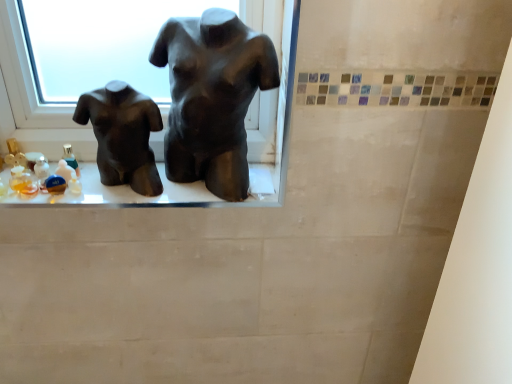
In order to face matte black torso at left, which ranks as the 2th statue (sculpture) in right-to-left order, should I rotate leftwards or rightwards?

A 17.664 degree turn to the left will do.

The height and width of the screenshot is (384, 512). What do you see at coordinates (212, 97) in the screenshot? I see `matte black torso at center, which is the 1th statue (sculpture) in right-to-left order` at bounding box center [212, 97].

Find the location of a particular element. The width and height of the screenshot is (512, 384). matte black torso at left, which appears as the first statue (sculpture) when viewed from the left is located at coordinates (123, 135).

Between matte black torso at left, which ranks as the 2th statue (sculpture) in right-to-left order, and matte black torso at center, which is the 1th statue (sculpture) in right-to-left order, which one is positioned in front?

matte black torso at center, which is the 1th statue (sculpture) in right-to-left order, is more forward.

Does point (155, 119) come farther from viewer compared to point (223, 62)?

Yes, it is behind point (223, 62).

Visually, is matte black torso at left, which ranks as the 2th statue (sculpture) in right-to-left order, positioned to the left or to the right of matte black torso at center, the 2th statue (sculpture) from the left?

matte black torso at left, which ranks as the 2th statue (sculpture) in right-to-left order, is positioned on matte black torso at center, the 2th statue (sculpture) from the left,'s left side.

Consider the image. From the image's perspective, is matte black torso at left, which appears as the first statue (sculpture) when viewed from the left, under matte black torso at center, which is the 1th statue (sculpture) in right-to-left order?

Yes.

Considering the positions of objects matte black torso at left, which ranks as the 2th statue (sculpture) in right-to-left order, and matte black mannequin torso at center in the image provided, who is behind, matte black torso at left, which ranks as the 2th statue (sculpture) in right-to-left order, or matte black mannequin torso at center?

Positioned behind is matte black mannequin torso at center.

Can you tell me how much matte black torso at left, which appears as the first statue (sculpture) when viewed from the left, and matte black mannequin torso at center differ in facing direction?

2.16 degrees separate the facing orientations of matte black torso at left, which appears as the first statue (sculpture) when viewed from the left, and matte black mannequin torso at center.

How much distance is there between matte black torso at left, which ranks as the 2th statue (sculpture) in right-to-left order, and matte black mannequin torso at center?

3.39 inches.

Are matte black torso at left, which appears as the first statue (sculpture) when viewed from the left, and matte black mannequin torso at center located far from each other?

That's not correct — matte black torso at left, which appears as the first statue (sculpture) when viewed from the left, is a little close to matte black mannequin torso at center.

Is matte black torso at center, which is the 1th statue (sculpture) in right-to-left order, wider than matte black mannequin torso at center?

No, matte black torso at center, which is the 1th statue (sculpture) in right-to-left order, is not wider than matte black mannequin torso at center.

From a real-world perspective, is matte black torso at center, the 2th statue (sculpture) from the left, located higher than matte black mannequin torso at center?

Yes, from a real-world perspective, matte black torso at center, the 2th statue (sculpture) from the left, is over matte black mannequin torso at center

Is matte black torso at center, which is the 1th statue (sculpture) in right-to-left order, bigger than matte black mannequin torso at center?

Indeed, matte black torso at center, which is the 1th statue (sculpture) in right-to-left order, has a larger size compared to matte black mannequin torso at center.

Can you tell me how much matte black torso at center, which is the 1th statue (sculpture) in right-to-left order, and matte black mannequin torso at center differ in facing direction?

The facing directions of matte black torso at center, which is the 1th statue (sculpture) in right-to-left order, and matte black mannequin torso at center are 29.9 degrees apart.

Can matte black torso at left, which appears as the first statue (sculpture) when viewed from the left, be found inside matte black torso at center, which is the 1th statue (sculpture) in right-to-left order?

No, matte black torso at left, which appears as the first statue (sculpture) when viewed from the left, is not a part of matte black torso at center, which is the 1th statue (sculpture) in right-to-left order.

Considering the positions of points (244, 55) and (126, 108), is point (244, 55) farther from camera compared to point (126, 108)?

No, (244, 55) is closer to viewer.

From the picture: Is matte black torso at center, the 2th statue (sculpture) from the left, further to camera compared to matte black torso at left, which appears as the first statue (sculpture) when viewed from the left?

No, matte black torso at center, the 2th statue (sculpture) from the left, is in front of matte black torso at left, which appears as the first statue (sculpture) when viewed from the left.

The width and height of the screenshot is (512, 384). In the image, there is a matte black torso at center, the 2th statue (sculpture) from the left. In order to click on statue (sculpture) below it (from the image's perspective) in this screenshot , I will do `click(123, 135)`.

Can you confirm if matte black mannequin torso at center is bigger than matte black torso at left, which ranks as the 2th statue (sculpture) in right-to-left order?

Incorrect, matte black mannequin torso at center is not larger than matte black torso at left, which ranks as the 2th statue (sculpture) in right-to-left order.

Considering their positions, is matte black mannequin torso at center located in front of or behind matte black torso at left, which appears as the first statue (sculpture) when viewed from the left?

Clearly, matte black mannequin torso at center is behind matte black torso at left, which appears as the first statue (sculpture) when viewed from the left.

From a real-world perspective, is matte black mannequin torso at center positioned above or below matte black torso at left, which ranks as the 2th statue (sculpture) in right-to-left order?

In terms of real-world spatial position, matte black mannequin torso at center is below matte black torso at left, which ranks as the 2th statue (sculpture) in right-to-left order.

From the image's perspective, is matte black mannequin torso at center over matte black torso at left, which appears as the first statue (sculpture) when viewed from the left?

Actually, matte black mannequin torso at center appears below matte black torso at left, which appears as the first statue (sculpture) when viewed from the left, in the image.

Considering the relative sizes of matte black mannequin torso at center and matte black torso at center, which is the 1th statue (sculpture) in right-to-left order, in the image provided, is matte black mannequin torso at center bigger than matte black torso at center, which is the 1th statue (sculpture) in right-to-left order,?

No, matte black mannequin torso at center is not bigger than matte black torso at center, which is the 1th statue (sculpture) in right-to-left order.

Considering the sizes of objects matte black mannequin torso at center and matte black torso at center, which is the 1th statue (sculpture) in right-to-left order, in the image provided, who is shorter, matte black mannequin torso at center or matte black torso at center, which is the 1th statue (sculpture) in right-to-left order,?

Standing shorter between the two is matte black mannequin torso at center.

Is the depth of matte black mannequin torso at center greater than that of matte black torso at center, the 2th statue (sculpture) from the left?

Yes, matte black mannequin torso at center is further from the viewer.

Are matte black mannequin torso at center and matte black torso at center, which is the 1th statue (sculpture) in right-to-left order, far apart?

No, matte black mannequin torso at center is not far away from matte black torso at center, which is the 1th statue (sculpture) in right-to-left order.

Locate an element on the screen. Image resolution: width=512 pixels, height=384 pixels. statue (sculpture) below the matte black torso at center, the 2th statue (sculpture) from the left (from a real-world perspective) is located at coordinates [123, 135].

You are a GUI agent. You are given a task and a screenshot of the screen. Output one action in this format:
    pyautogui.click(x=<x>, y=<y>)
    Task: Click on the window sill located on the right of matte black torso at left, which ranks as the 2th statue (sculpture) in right-to-left order
    Image resolution: width=512 pixels, height=384 pixels.
    Given the screenshot: What is the action you would take?
    pyautogui.click(x=119, y=193)

Consider the image. Which object lies further to the anchor point matte black torso at center, which is the 1th statue (sculpture) in right-to-left order, matte black torso at left, which appears as the first statue (sculpture) when viewed from the left, or matte black mannequin torso at center?

matte black mannequin torso at center.

Looking at the image, which one is located further to matte black mannequin torso at center, matte black torso at left, which ranks as the 2th statue (sculpture) in right-to-left order, or matte black torso at center, the 2th statue (sculpture) from the left?

matte black torso at center, the 2th statue (sculpture) from the left, is positioned further to the anchor matte black mannequin torso at center.

Considering their positions, is matte black torso at center, the 2th statue (sculpture) from the left, positioned closer to matte black mannequin torso at center than matte black torso at left, which ranks as the 2th statue (sculpture) in right-to-left order?

matte black torso at left, which ranks as the 2th statue (sculpture) in right-to-left order.

Estimate the real-world distances between objects in this image. Which object is further from matte black torso at center, the 2th statue (sculpture) from the left, matte black mannequin torso at center or matte black torso at left, which appears as the first statue (sculpture) when viewed from the left?

The object further to matte black torso at center, the 2th statue (sculpture) from the left, is matte black mannequin torso at center.

Estimate the real-world distances between objects in this image. Which object is closer to matte black torso at left, which ranks as the 2th statue (sculpture) in right-to-left order, matte black torso at center, which is the 1th statue (sculpture) in right-to-left order, or matte black mannequin torso at center?

matte black mannequin torso at center is closer to matte black torso at left, which ranks as the 2th statue (sculpture) in right-to-left order.

From the picture: When comparing their distances from matte black torso at left, which appears as the first statue (sculpture) when viewed from the left, does matte black mannequin torso at center or matte black torso at center, which is the 1th statue (sculpture) in right-to-left order, seem further?

matte black torso at center, which is the 1th statue (sculpture) in right-to-left order, is further to matte black torso at left, which appears as the first statue (sculpture) when viewed from the left.

The image size is (512, 384). Identify the location of window sill between matte black torso at left, which appears as the first statue (sculpture) when viewed from the left, and matte black torso at center, which is the 1th statue (sculpture) in right-to-left order, from left to right. (119, 193).